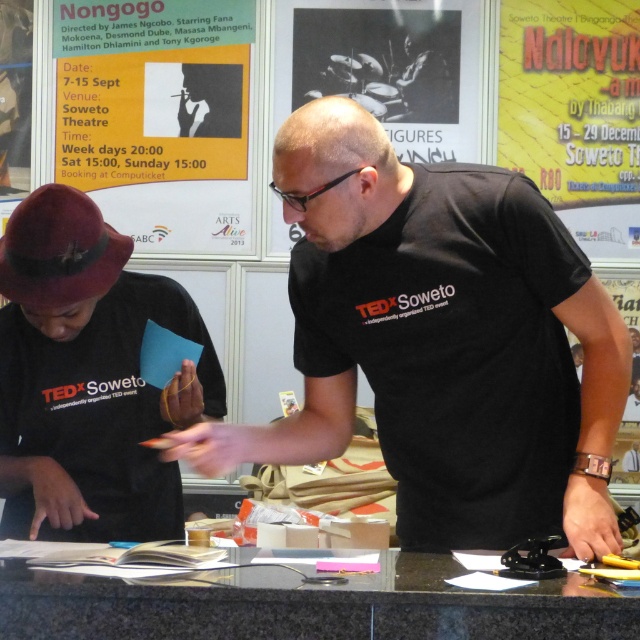
Does black matte shirt at center appear over matte black hat at left?

Yes, black matte shirt at center is above matte black hat at left.

Is black matte shirt at center in front of matte black hat at left?

Yes, black matte shirt at center is in front of matte black hat at left.

Does point (208, 436) come closer to viewer compared to point (122, 417)?

Yes, it is in front of point (122, 417).

Locate an element on the screen. Image resolution: width=640 pixels, height=640 pixels. black matte shirt at center is located at coordinates [x=440, y=340].

Is matte paper poster at upper left shorter than yellow paper poster at upper center?

Correct, matte paper poster at upper left is not as tall as yellow paper poster at upper center.

Is matte paper poster at upper left below yellow paper poster at upper center?

No.

Which is in front, point (179, 68) or point (634, 72)?

Positioned in front is point (179, 68).

What are the coordinates of `matte paper poster at upper left` in the screenshot? It's located at (157, 116).

Looking at this image, is granite table at center above yellow paper poster at upper center?

Incorrect, granite table at center is not positioned above yellow paper poster at upper center.

Is granite table at center in front of yellow paper poster at upper center?

Yes, granite table at center is in front of yellow paper poster at upper center.

Image resolution: width=640 pixels, height=640 pixels. In order to click on granite table at center in this screenshot , I will do `click(307, 604)`.

Find the location of a particular element. This screenshot has height=640, width=640. granite table at center is located at coordinates (307, 604).